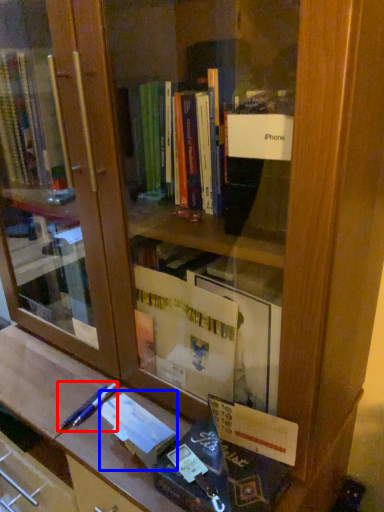
Question: Among these objects, which one is nearest to the camera, pencil (highlighted by a red box) or paperback book (highlighted by a blue box)?

Choices:
 (A) pencil
 (B) paperback book

Answer: (B)